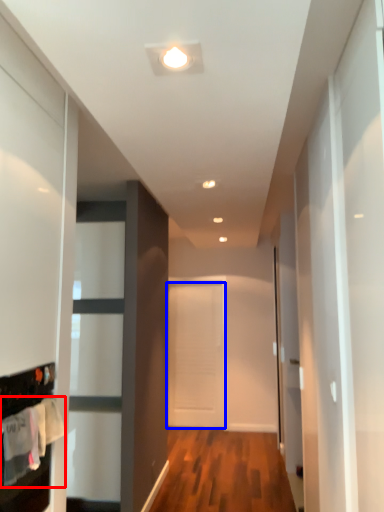
Question: Which point is closer to the camera, laundry (highlighted by a red box) or door (highlighted by a blue box)?

Choices:
 (A) laundry
 (B) door

Answer: (A)